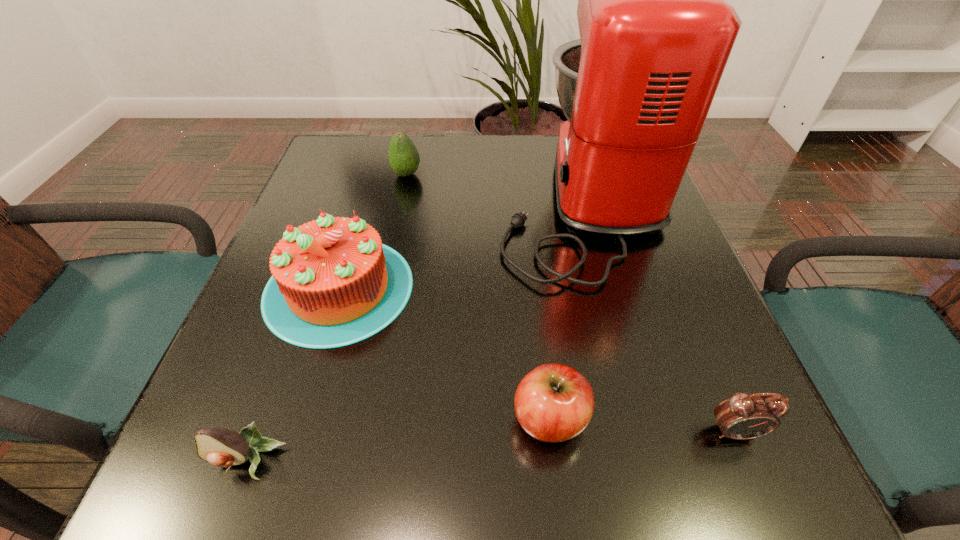
This screenshot has width=960, height=540. I want to click on the tallest object, so click(655, 32).

Image resolution: width=960 pixels, height=540 pixels. Identify the location of the fifth shortest object. (333, 284).

Locate an element on the screen. Image resolution: width=960 pixels, height=540 pixels. the farther avocado is located at coordinates 403,155.

This screenshot has height=540, width=960. Identify the location of apple. (553, 403).

Find the location of a particular element. This screenshot has height=540, width=960. alarm clock is located at coordinates (743, 416).

Where is `the nearer avocado`? The image size is (960, 540). the nearer avocado is located at coordinates (220, 447).

Find the location of a particular element. Image resolution: width=960 pixels, height=540 pixels. free location located 0.300m on the front-facing side of the tallest object is located at coordinates tap(365, 199).

Where is `free space located 0.170m on the front-facing side of the tallest object`? This screenshot has height=540, width=960. free space located 0.170m on the front-facing side of the tallest object is located at coordinates (422, 199).

The image size is (960, 540). Identify the location of free space located on the front-facing side of the tallest object. (418, 199).

Identify the location of free spot located 0.320m on the back of the cake. (378, 157).